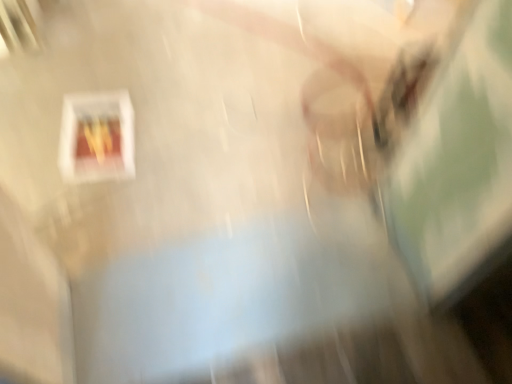
You are a GUI agent. You are given a task and a screenshot of the screen. Output one action in this format:
    pyautogui.click(x=<x>, y=<y>)
    Task: Click on the spots to the right of matte wooden picture frame at lower left
    The width and height of the screenshot is (512, 384).
    Given the screenshot: What is the action you would take?
    172,146